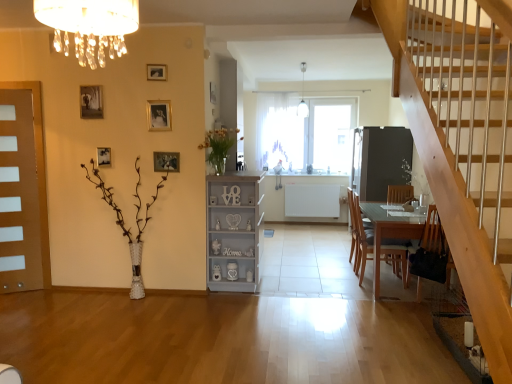
Question: Can you confirm if matte brown door at left is taller than matte black picture frame at left, acting as the second picture frame starting from the left?

Choices:
 (A) yes
 (B) no

Answer: (A)

Question: From the image's perspective, is matte brown door at left located above matte black picture frame at left, which is the 5th picture frame in front-to-back order?

Choices:
 (A) no
 (B) yes

Answer: (A)

Question: Is matte black picture frame at left, acting as the second picture frame starting from the left, a part of matte brown door at left?

Choices:
 (A) yes
 (B) no

Answer: (B)

Question: Does matte brown door at left appear on the right side of matte black picture frame at left, which is the 2th picture frame in back-to-front order?

Choices:
 (A) no
 (B) yes

Answer: (A)

Question: Does matte brown door at left have a lesser width compared to matte black picture frame at left, acting as the second picture frame starting from the left?

Choices:
 (A) yes
 (B) no

Answer: (B)

Question: Considering the positions of wooden picture frame at center, marked as the fifth picture frame in a left-to-right arrangement, and transparent glass window at center in the image, is wooden picture frame at center, marked as the fifth picture frame in a left-to-right arrangement, wider or thinner than transparent glass window at center?

Choices:
 (A) thin
 (B) wide

Answer: (A)

Question: Considering the positions of point (158, 160) and point (280, 97), is point (158, 160) closer or farther from the camera than point (280, 97)?

Choices:
 (A) closer
 (B) farther

Answer: (A)

Question: From the image's perspective, is wooden picture frame at center, the 3th picture frame positioned from the back, located above or below transparent glass window at center?

Choices:
 (A) above
 (B) below

Answer: (B)

Question: Visually, is wooden picture frame at center, marked as the fifth picture frame in a left-to-right arrangement, positioned to the left or to the right of transparent glass window at center?

Choices:
 (A) right
 (B) left

Answer: (B)

Question: Is gold metallic picture frame at upper center, which is the 3th picture frame from right to left, wider or thinner than matte black picture frame at left, which is the 2th picture frame in back-to-front order?

Choices:
 (A) wide
 (B) thin

Answer: (B)

Question: Is point (150, 129) positioned closer to the camera than point (96, 162)?

Choices:
 (A) closer
 (B) farther

Answer: (A)

Question: Would you say gold metallic picture frame at upper center, positioned as the fourth picture frame in left-to-right order, is to the left or to the right of matte black picture frame at left, which is the 2th picture frame in back-to-front order, in the picture?

Choices:
 (A) right
 (B) left

Answer: (A)

Question: In the image, is gold metallic picture frame at upper center, the fifth picture frame positioned from the back, positioned in front of or behind matte black picture frame at left, which is the 5th picture frame in front-to-back order?

Choices:
 (A) behind
 (B) front

Answer: (B)

Question: From the image's perspective, relative to white textured vase at left, which ranks as the first plant in left-to-right order, is matte white crystal chandelier at upper center above or below?

Choices:
 (A) above
 (B) below

Answer: (A)

Question: Is matte white crystal chandelier at upper center taller or shorter than white textured vase at left, the second plant viewed from the right?

Choices:
 (A) tall
 (B) short

Answer: (B)